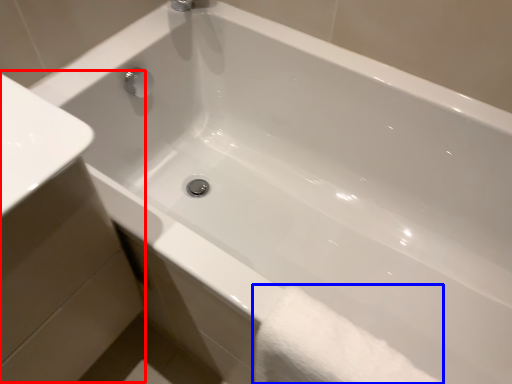
Question: Which object appears closest to the camera in this image, sink (highlighted by a red box) or bath towel (highlighted by a blue box)?

Choices:
 (A) sink
 (B) bath towel

Answer: (A)